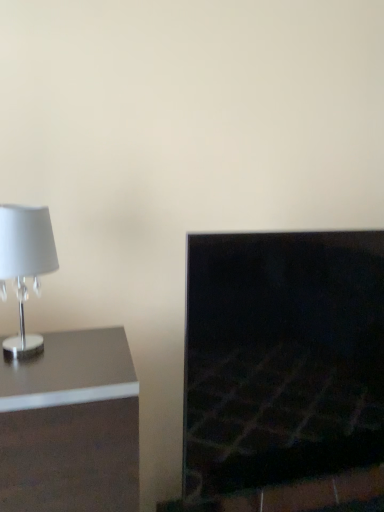
Question: Would you say satin silver lamp at left is to the left or to the right of dark stone fireplace at right in the picture?

Choices:
 (A) right
 (B) left

Answer: (B)

Question: Is satin silver lamp at left in front of or behind dark stone fireplace at right in the image?

Choices:
 (A) front
 (B) behind

Answer: (A)

Question: Estimate the real-world distances between objects in this image. Which object is closer to the white glossy lampshade at left?

Choices:
 (A) dark stone fireplace at right
 (B) satin silver lamp at left

Answer: (B)

Question: Which object is positioned closest to the white glossy lampshade at left?

Choices:
 (A) dark stone fireplace at right
 (B) satin silver lamp at left

Answer: (B)